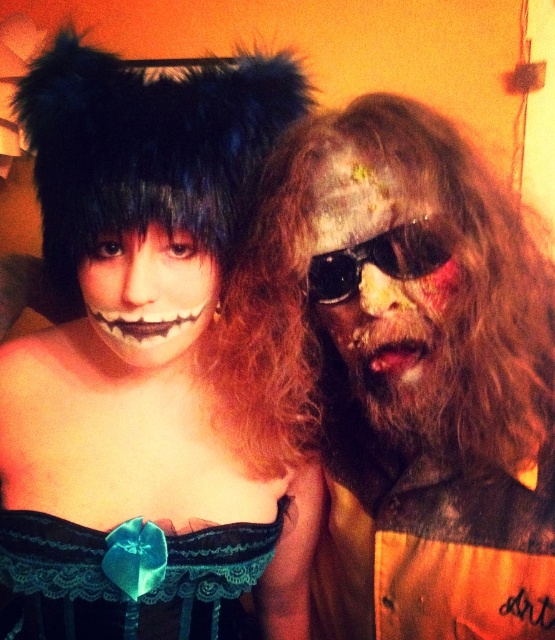
Question: Can you confirm if black fur hat at upper left is positioned below matte orange shirt at center?

Choices:
 (A) no
 (B) yes

Answer: (A)

Question: Is black fur hat at upper left to the left of white matte face paint at center from the viewer's perspective?

Choices:
 (A) yes
 (B) no

Answer: (A)

Question: Which point is farther from the camera taking this photo?

Choices:
 (A) (111, 532)
 (B) (417, 204)

Answer: (A)

Question: Based on their relative distances, which object is farther from the painted flesh mask at right?

Choices:
 (A) black plastic sunglasses at right
 (B) matte orange shirt at center
 (C) lace fabric dress at center
 (D) white matte face paint at center

Answer: (C)

Question: Estimate the real-world distances between objects in this image. Which object is closer to the matte orange shirt at center?

Choices:
 (A) white matte face paint at center
 (B) lace fabric dress at center
 (C) black plastic sunglasses at right

Answer: (C)

Question: Does matte orange shirt at center lie in front of painted flesh mask at right?

Choices:
 (A) no
 (B) yes

Answer: (A)